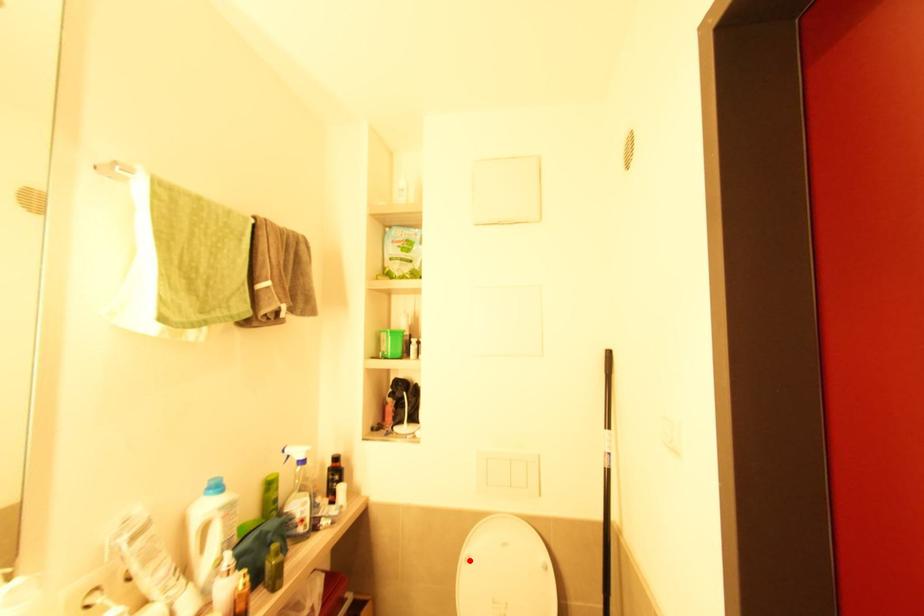
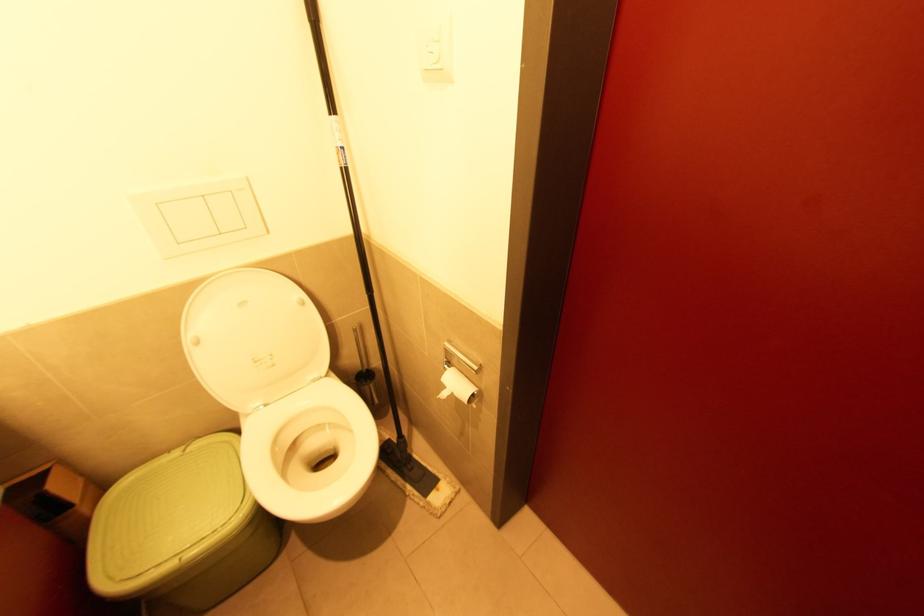
Find the pixel in the second image that matches the highlighted location in the first image.

(200, 342)